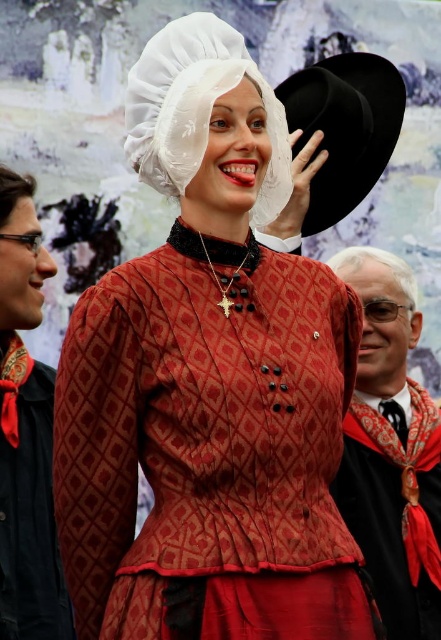
Question: Does matte red dress at center appear on the right side of matte red fabric dress at center?

Choices:
 (A) yes
 (B) no

Answer: (A)

Question: Which object is positioned closest to the matte red dress at center?

Choices:
 (A) smooth black hat at right
 (B) matte red fabric dress at center

Answer: (A)

Question: Among these objects, which one is farthest from the camera?

Choices:
 (A) black felt hat at upper right
 (B) matte red dress at center
 (C) white sheer bonnet at center

Answer: (A)

Question: Is matte red fabric dress at center to the right of white sheer bonnet at center from the viewer's perspective?

Choices:
 (A) yes
 (B) no

Answer: (B)

Question: Does white sheer bonnet at center have a larger size compared to black felt hat at upper right?

Choices:
 (A) no
 (B) yes

Answer: (A)

Question: Which point is closer to the camera taking this photo?

Choices:
 (A) (33, 390)
 (B) (399, 636)
 (C) (205, 20)

Answer: (C)